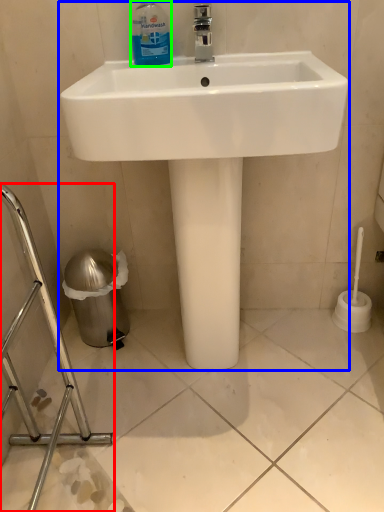
Question: Which object is the farthest from porcelain (highlighted by a red box)? Choose among these: sink (highlighted by a blue box) or cleaning product (highlighted by a green box).

Choices:
 (A) sink
 (B) cleaning product

Answer: (B)